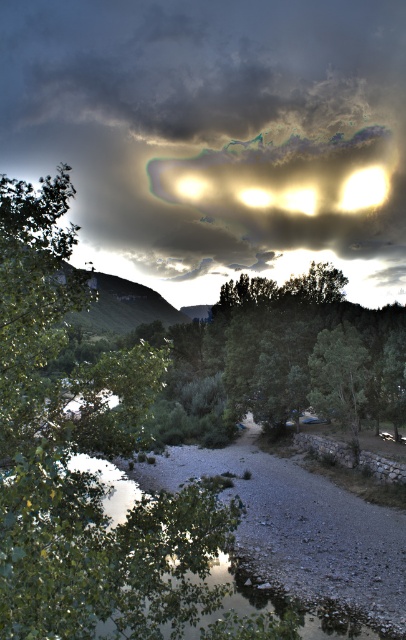
You are standing at the edge of the water in the serene landscape scene. You see two points marked in the image. Which point is closer to you, point (75, 106) or point (187, 499)?

Point (75, 106) is closer to you because it is further to the viewer than point (187, 499).

You are standing in the serene landscape and want to take a photo of the cloudy sky at upper center. According to the coordinates provided, where exactly is the cloudy sky located?

The cloudy sky at upper center is located at point coordinates of 0.211 on the x axis and 0.532 on the y axis.